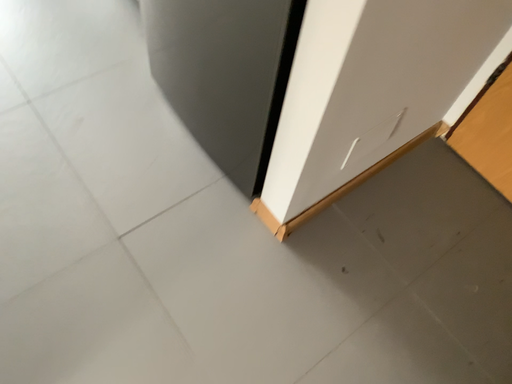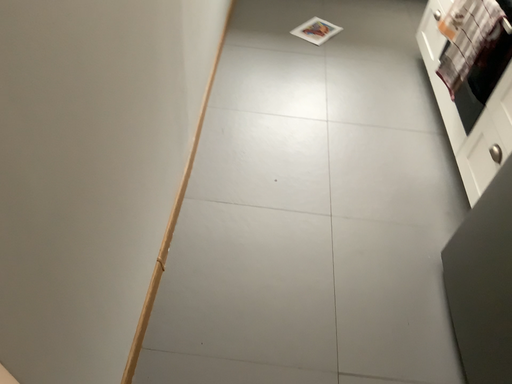
Question: Which way did the camera rotate in the video?

Choices:
 (A) rotated upward
 (B) rotated downward

Answer: (A)